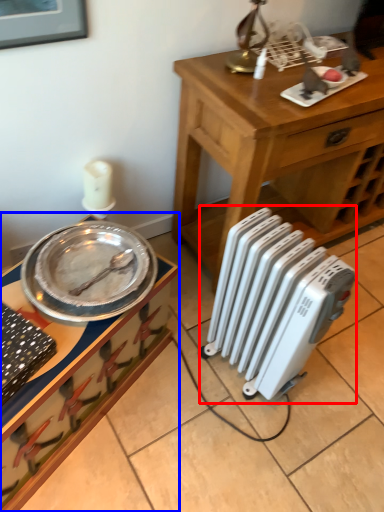
Question: Which of the following is the farthest to the observer, radiator (highlighted by a red box) or desk (highlighted by a blue box)?

Choices:
 (A) radiator
 (B) desk

Answer: (A)